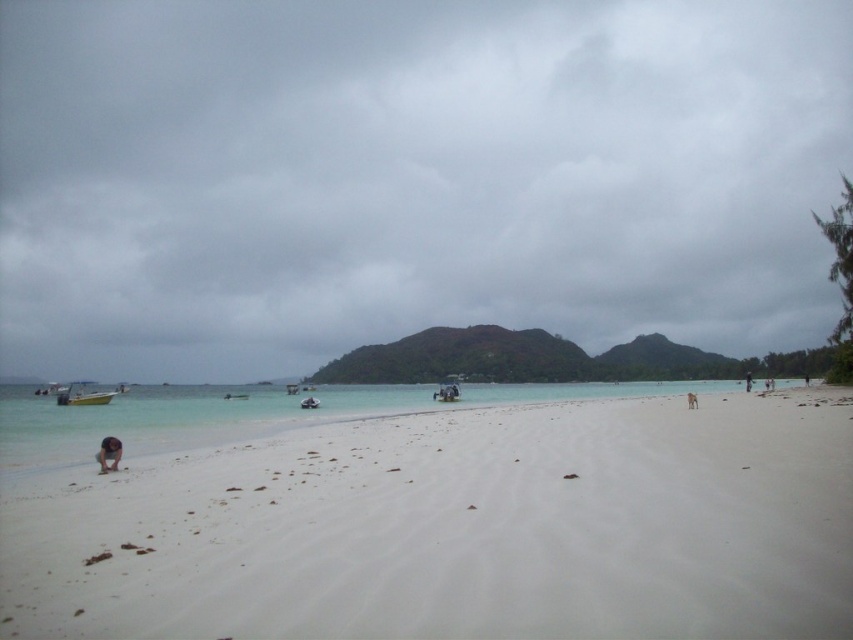
Question: Does white sandy beach at lower left appear under clear blue water at center?

Choices:
 (A) no
 (B) yes

Answer: (A)

Question: Which object is positioned closest to the white sandy beach at lower left?

Choices:
 (A) dark brown skin at lower right
 (B) clear blue water at center
 (C) light brown skin at lower left

Answer: (B)

Question: Does white sandy beach at lower left appear under brown sand at lower center?

Choices:
 (A) no
 (B) yes

Answer: (B)

Question: Among these points, which one is nearest to the camera?

Choices:
 (A) (755, 408)
 (B) (750, 378)
 (C) (691, 392)
 (D) (102, 468)

Answer: (D)

Question: Which object appears farthest from the camera in this image?

Choices:
 (A) dark brown skin at lower right
 (B) clear blue water at center
 (C) brown sand at lower center

Answer: (A)

Question: Is clear blue water at center to the right of brown sand at lower center from the viewer's perspective?

Choices:
 (A) no
 (B) yes

Answer: (A)